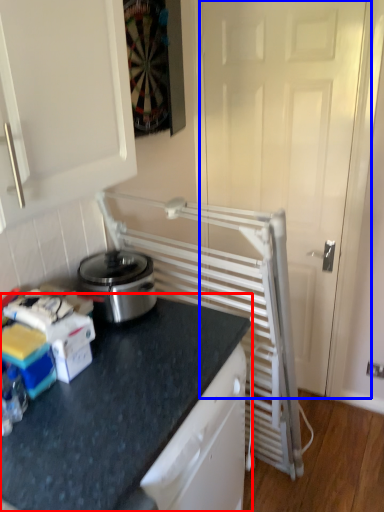
Question: Among these objects, which one is nearest to the camera, countertop (highlighted by a red box) or screen door (highlighted by a blue box)?

Choices:
 (A) countertop
 (B) screen door

Answer: (A)